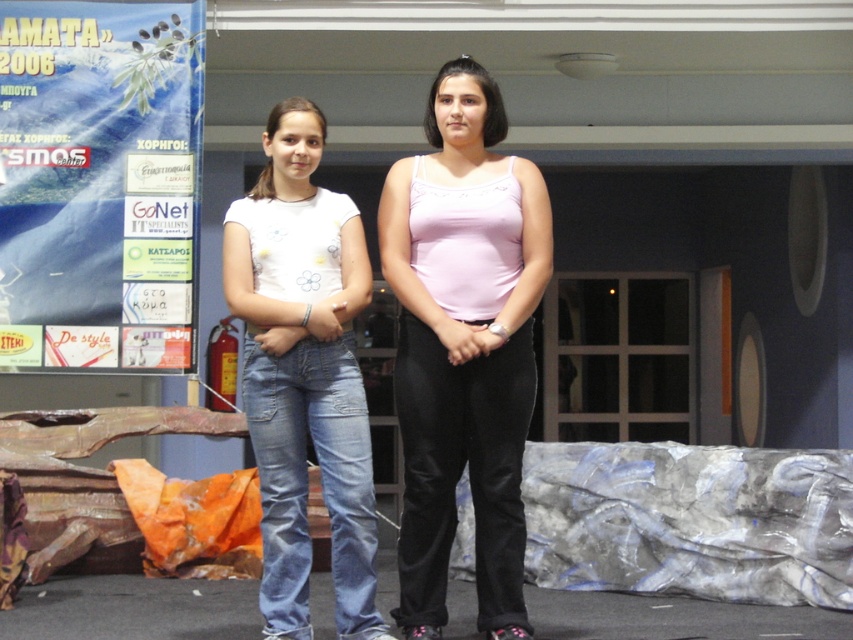
Question: In this image, where is blue paperboard poster at left located relative to pink fabric tank top at center?

Choices:
 (A) right
 (B) left

Answer: (B)

Question: Which is farther from the white denim jeans at left?

Choices:
 (A) pink fabric tank top at center
 (B) blue paperboard poster at left

Answer: (B)

Question: Among these points, which one is farthest from the camera?

Choices:
 (A) (538, 196)
 (B) (196, 168)

Answer: (B)

Question: Which object is the farthest from the pink fabric tank top at center?

Choices:
 (A) white denim jeans at left
 (B) blue paperboard poster at left

Answer: (B)

Question: Is blue paperboard poster at left smaller than pink fabric tank top at center?

Choices:
 (A) no
 (B) yes

Answer: (B)

Question: Does blue paperboard poster at left have a smaller size compared to pink fabric tank top at center?

Choices:
 (A) no
 (B) yes

Answer: (B)